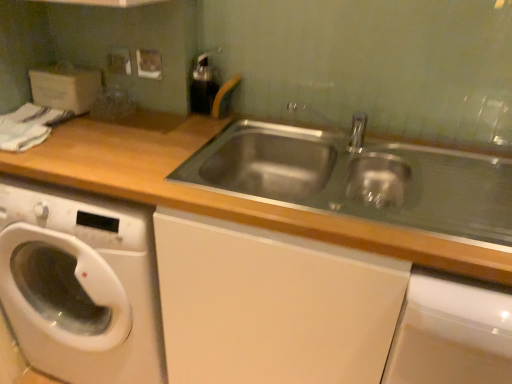
Question: Should I look upward or downward to see white glossy washing machine at lower left?

Choices:
 (A) down
 (B) up

Answer: (A)

Question: From a real-world perspective, is wooden at left located higher than white glossy washing machine at lower left?

Choices:
 (A) no
 (B) yes

Answer: (B)

Question: Is wooden at left looking in the opposite direction of white glossy washing machine at lower left?

Choices:
 (A) yes
 (B) no

Answer: (A)

Question: Does wooden at left have a smaller size compared to white glossy washing machine at lower left?

Choices:
 (A) yes
 (B) no

Answer: (B)

Question: Does wooden at left lie behind white glossy washing machine at lower left?

Choices:
 (A) yes
 (B) no

Answer: (B)

Question: Is white glossy washing machine at lower left a part of wooden at left?

Choices:
 (A) yes
 (B) no

Answer: (A)

Question: Would you say wooden at left is a long distance from white glossy washing machine at lower left?

Choices:
 (A) no
 (B) yes

Answer: (A)

Question: Considering the relative positions of metallic silver electric outlet at upper left and wooden at left in the image provided, is metallic silver electric outlet at upper left to the left of wooden at left from the viewer's perspective?

Choices:
 (A) no
 (B) yes

Answer: (B)

Question: Can you confirm if metallic silver electric outlet at upper left is taller than wooden at left?

Choices:
 (A) no
 (B) yes

Answer: (A)

Question: Are metallic silver electric outlet at upper left and wooden at left far apart?

Choices:
 (A) no
 (B) yes

Answer: (A)

Question: Can you confirm if metallic silver electric outlet at upper left is shorter than wooden at left?

Choices:
 (A) no
 (B) yes

Answer: (B)

Question: Does metallic silver electric outlet at upper left turn towards wooden at left?

Choices:
 (A) no
 (B) yes

Answer: (A)

Question: From the image's perspective, would you say metallic silver electric outlet at upper left is positioned over wooden at left?

Choices:
 (A) no
 (B) yes

Answer: (B)

Question: Is metallic silver electric outlet at upper left inside wooden at left?

Choices:
 (A) yes
 (B) no

Answer: (B)